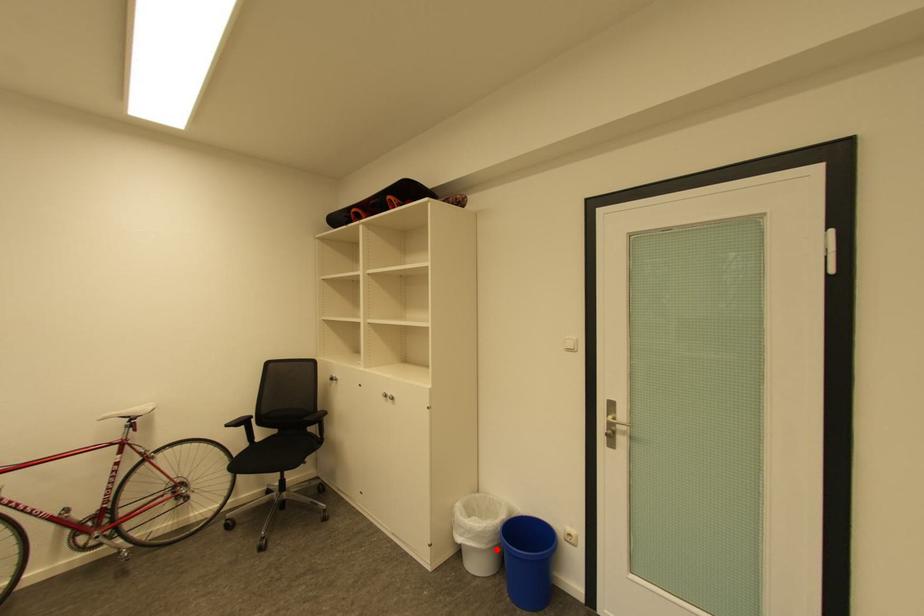
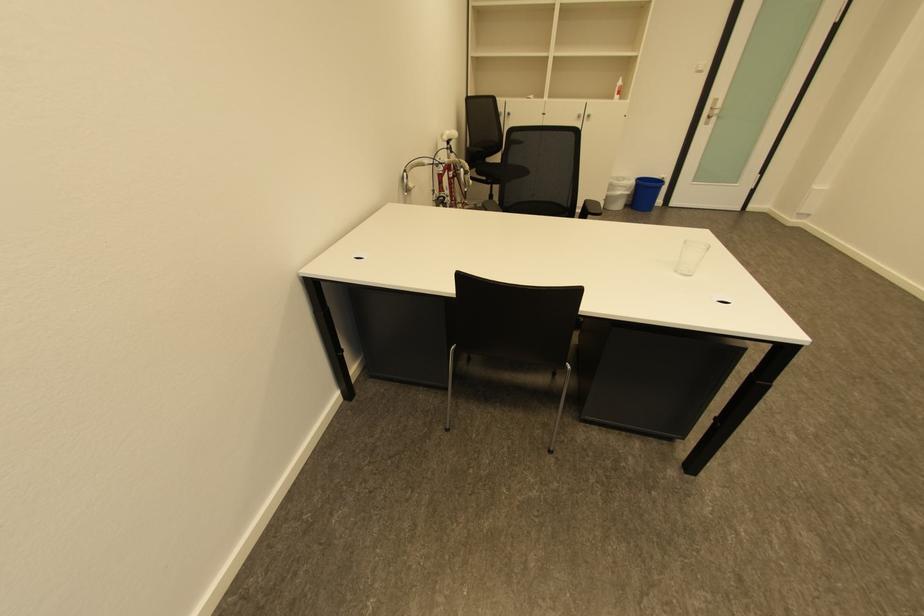
Where in the second image is the point corresponding to the highlighted location from the first image?

(635, 196)